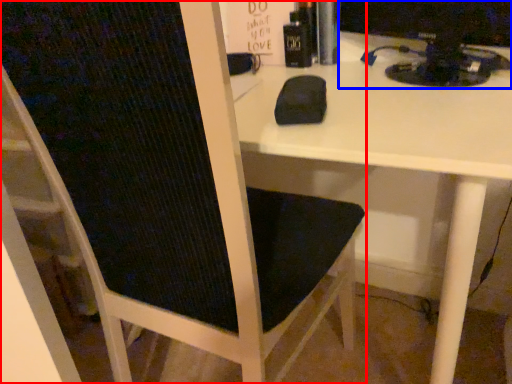
Question: Which of the following is the closest to the observer, chair (highlighted by a red box) or desktop computer (highlighted by a blue box)?

Choices:
 (A) chair
 (B) desktop computer

Answer: (A)